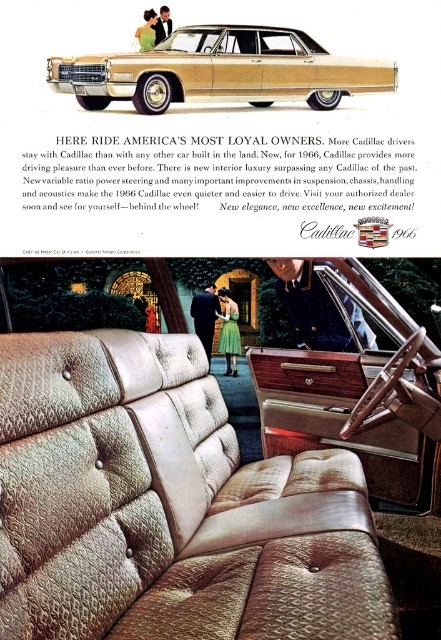
You are a photographer standing at a certain position. You want to take a photo of the gold textured car at center. If your camera has a focal length of 50mm and you want to capture the entire car in the frame, would you need to move closer or farther away? Assume the car is 18 feet long.

The gold textured car at center and camera are 4.81 feet apart from each other. To capture an 18 feet long car with a 50mm lens, the photographer should move farther away because the current distance is too close for the lens to capture the entire car.

You are a car enthusiast looking at this vintage Cadillac ad. You notice the gold textured car at center and the beige textured leather interior at center. Which object appears closer to you in the image?

The gold textured car at center is closer to the viewer than the beige textured leather interior at center.